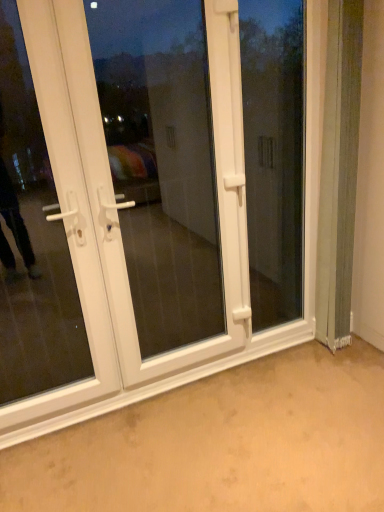
I want to click on vacant space in white plastic door at left, which ranks as the first door in left-to-right order (from a real-world perspective), so pyautogui.click(x=51, y=421).